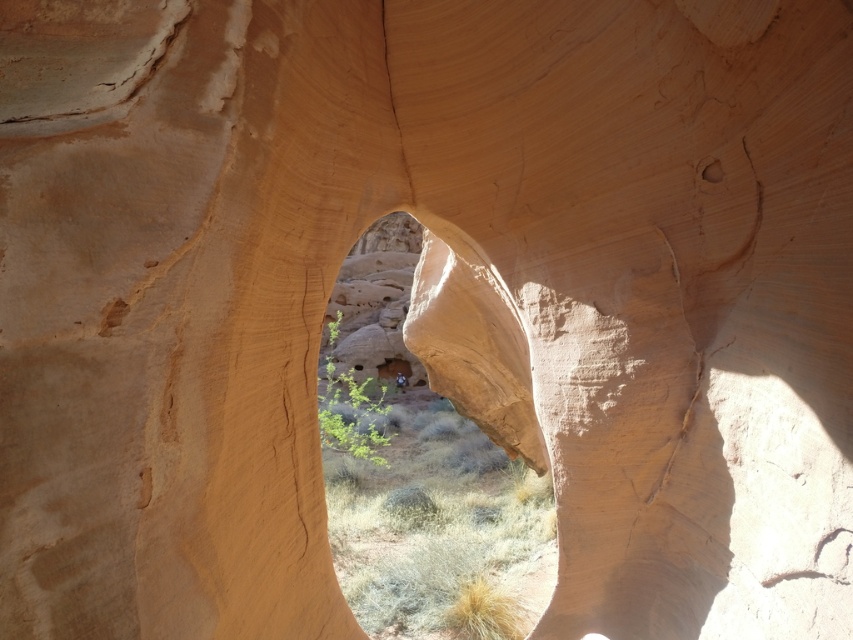
Is point (373, 512) closer to camera compared to point (711, 161)?

No, it is not.

Does smooth sandstone arch at center have a lesser height compared to smooth sandstone hole at upper center?

No.

Describe the element at coordinates (416, 468) in the screenshot. I see `smooth sandstone arch at center` at that location.

Find the location of a particular element. The height and width of the screenshot is (640, 853). smooth sandstone arch at center is located at coordinates (416, 468).